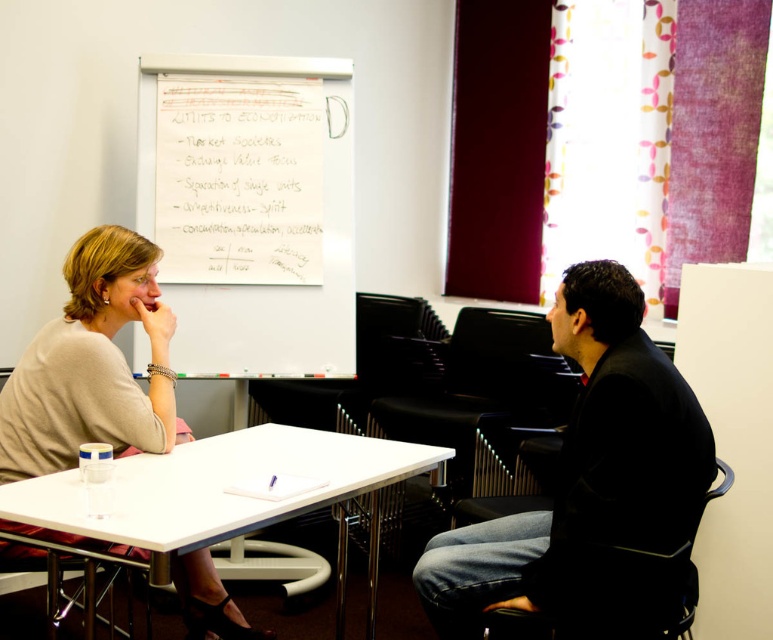
Question: Among these objects, which one is farthest from the camera?

Choices:
 (A) black smooth suit at center
 (B) whiteboard at upper center

Answer: (B)

Question: Does white handwritten notes at upper center have a greater width compared to white plastic table at center?

Choices:
 (A) yes
 (B) no

Answer: (B)

Question: Which of the following is the farthest from the observer?

Choices:
 (A) white plastic table at center
 (B) light beige sweater at center
 (C) whiteboard at upper center
 (D) black smooth suit at center

Answer: (C)

Question: Which point is closer to the camera?

Choices:
 (A) black smooth suit at center
 (B) whiteboard at upper center
 (C) white plastic table at center
 (D) light beige sweater at center

Answer: (C)

Question: Is light beige sweater at center thinner than black smooth suit at center?

Choices:
 (A) yes
 (B) no

Answer: (A)

Question: Observing the image, what is the correct spatial positioning of light beige sweater at center in reference to white handwritten notes at upper center?

Choices:
 (A) right
 (B) left

Answer: (B)